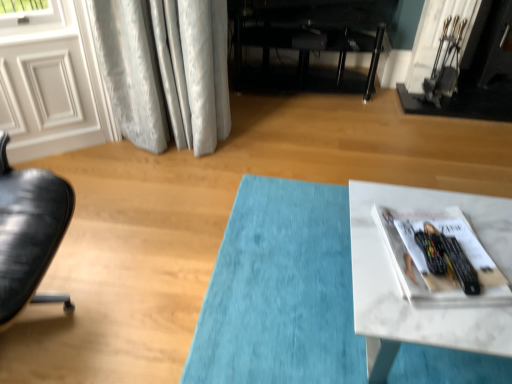
You are a GUI agent. You are given a task and a screenshot of the screen. Output one action in this format:
    pyautogui.click(x=<x>, y=<y>)
    Task: Click on the white glossy magazine at lower right
    
    Given the screenshot: What is the action you would take?
    pyautogui.click(x=440, y=259)

In the scene shown: What is the approximate height of white glossy door at upper left?

The height of white glossy door at upper left is 62.54 centimeters.

Identify the location of black metal fireplace at upper right. The height and width of the screenshot is (384, 512). (474, 70).

Is white marble table at lower right not near black glossy entertainment center at center?

white marble table at lower right is positioned a significant distance from black glossy entertainment center at center.

Is white marble table at lower right bigger than black glossy entertainment center at center?

Actually, white marble table at lower right might be smaller than black glossy entertainment center at center.

Consider the image. Is white marble table at lower right aimed at black glossy entertainment center at center?

No, white marble table at lower right does not turn towards black glossy entertainment center at center.

Is white marble table at lower right outside of black glossy entertainment center at center?

white marble table at lower right is positioned outside black glossy entertainment center at center.

Considering the relative positions of white glossy door at upper left and white glossy magazine at lower right in the image provided, is white glossy door at upper left behind white glossy magazine at lower right?

That is True.

Can you confirm if white glossy door at upper left is bigger than white glossy magazine at lower right?

Yes.

Which object is wider, white glossy door at upper left or white glossy magazine at lower right?

white glossy magazine at lower right is wider.

From the image's perspective, is white glossy magazine at lower right located above or below white marble table at lower right?

Based on their image positions, white glossy magazine at lower right is located above white marble table at lower right.

Is white glossy magazine at lower right beside white marble table at lower right?

Yes.

Can you confirm if white glossy magazine at lower right is taller than white marble table at lower right?

Incorrect, the height of white glossy magazine at lower right is not larger of that of white marble table at lower right.

Does point (420, 270) appear closer or farther from the camera than point (466, 347)?

Point (420, 270) appears to be farther away from the viewer than point (466, 347).

From a real-world perspective, is white glossy door at upper left over black glossy entertainment center at center?

Correct, in the physical world, white glossy door at upper left is higher than black glossy entertainment center at center.

Which is behind, point (8, 65) or point (300, 9)?

The point (300, 9) is behind.

Between white glossy door at upper left and black glossy entertainment center at center, which one appears on the right side from the viewer's perspective?

Positioned to the right is black glossy entertainment center at center.

Does white glossy door at upper left turn towards black glossy entertainment center at center?

No, white glossy door at upper left does not turn towards black glossy entertainment center at center.

Who is more distant, white marble table at lower right or black metal fireplace at upper right?

black metal fireplace at upper right.

Find the location of a particular element. table below the black metal fireplace at upper right (from a real-world perspective) is located at coordinates (398, 279).

Is point (431, 194) closer or farther from the camera than point (474, 34)?

Point (431, 194).

Which of these two, white marble table at lower right or black metal fireplace at upper right, is bigger?

white marble table at lower right.

Which is more to the right, white glossy door at upper left or black metal fireplace at upper right?

Positioned to the right is black metal fireplace at upper right.

Between white glossy door at upper left and black metal fireplace at upper right, which one has larger size?

With larger size is white glossy door at upper left.

Is white glossy door at upper left aimed at black metal fireplace at upper right?

No, white glossy door at upper left does not turn towards black metal fireplace at upper right.

Can you confirm if black metal fireplace at upper right is positioned to the right of white marble table at lower right?

Correct, you'll find black metal fireplace at upper right to the right of white marble table at lower right.

Is black metal fireplace at upper right spatially inside white marble table at lower right, or outside of it?

black metal fireplace at upper right is outside white marble table at lower right.

How many degrees apart are the facing directions of black metal fireplace at upper right and white marble table at lower right?

The angular difference between black metal fireplace at upper right and white marble table at lower right is 87 degrees.

Find the location of a particular element. The height and width of the screenshot is (384, 512). table that is in front of the black glossy entertainment center at center is located at coordinates (398, 279).

Where is `screen door that is on the left side of white glossy magazine at lower right`? This screenshot has height=384, width=512. screen door that is on the left side of white glossy magazine at lower right is located at coordinates (52, 82).

From the image, which object appears to be nearer to white glossy door at upper left, black metal fireplace at upper right or white marble table at lower right?

white marble table at lower right is positioned closer to the anchor white glossy door at upper left.

Based on their spatial positions, is white glossy magazine at lower right or black glossy entertainment center at center closer to white marble table at lower right?

white glossy magazine at lower right is closer to white marble table at lower right.

Based on their spatial positions, is black metal fireplace at upper right or white marble table at lower right further from white glossy magazine at lower right?

Based on the image, black metal fireplace at upper right appears to be further to white glossy magazine at lower right.

Consider the image. From the image, which object appears to be farther from black metal fireplace at upper right, white glossy magazine at lower right or white glossy door at upper left?

Among the two, white glossy door at upper left is located further to black metal fireplace at upper right.

Estimate the real-world distances between objects in this image. Which object is further from white glossy door at upper left, black glossy entertainment center at center or white glossy magazine at lower right?

white glossy magazine at lower right is further to white glossy door at upper left.

From the image, which object appears to be nearer to black glossy entertainment center at center, white marble table at lower right or black metal fireplace at upper right?

Based on the image, black metal fireplace at upper right appears to be nearer to black glossy entertainment center at center.

Which object lies further to the anchor point white glossy magazine at lower right, white glossy door at upper left or black metal fireplace at upper right?

black metal fireplace at upper right.

Considering their positions, is white glossy magazine at lower right positioned closer to black glossy entertainment center at center than black metal fireplace at upper right?

black metal fireplace at upper right.

Locate an element on the screen. The image size is (512, 384). magazine situated between white glossy door at upper left and black metal fireplace at upper right from left to right is located at coordinates coord(440,259).

Find the location of a particular element. The height and width of the screenshot is (384, 512). magazine between white marble table at lower right and black metal fireplace at upper right from front to back is located at coordinates [x=440, y=259].

In order to click on entertainment center located between white glossy door at upper left and white glossy magazine at lower right in the left-right direction in this screenshot , I will do `click(310, 32)`.

This screenshot has height=384, width=512. In order to click on fireplace located between white marble table at lower right and black glossy entertainment center at center in the depth direction in this screenshot , I will do `click(474, 70)`.